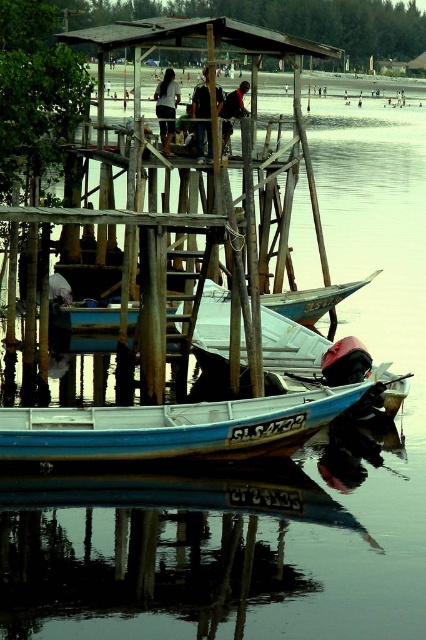
You are a photographer standing on the wooden platform. You want to take a photo of the dark blue shirt at center and the dark brown leather jacket at upper center. Which one is positioned higher in the frame?

The dark blue shirt at center is located above the dark brown leather jacket at upper center, so it is positioned higher in the frame.

You are a photographer trying to capture a group photo of the people on the wooden platform. You notice two individuals wearing a dark blue shirt at center and a dark brown leather jacket at upper center. Considering their sizes, which one would appear closer to the camera in the photo?

The dark blue shirt at center has a larger size compared to the dark brown leather jacket at upper center, so the dark blue shirt at center would appear closer to the camera in the photo because larger objects typically appear closer in a photograph.